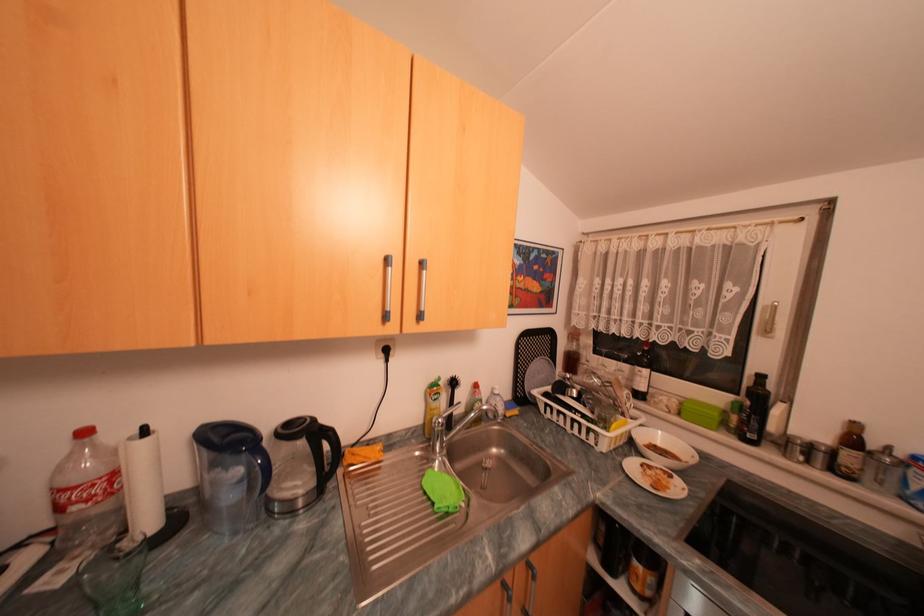
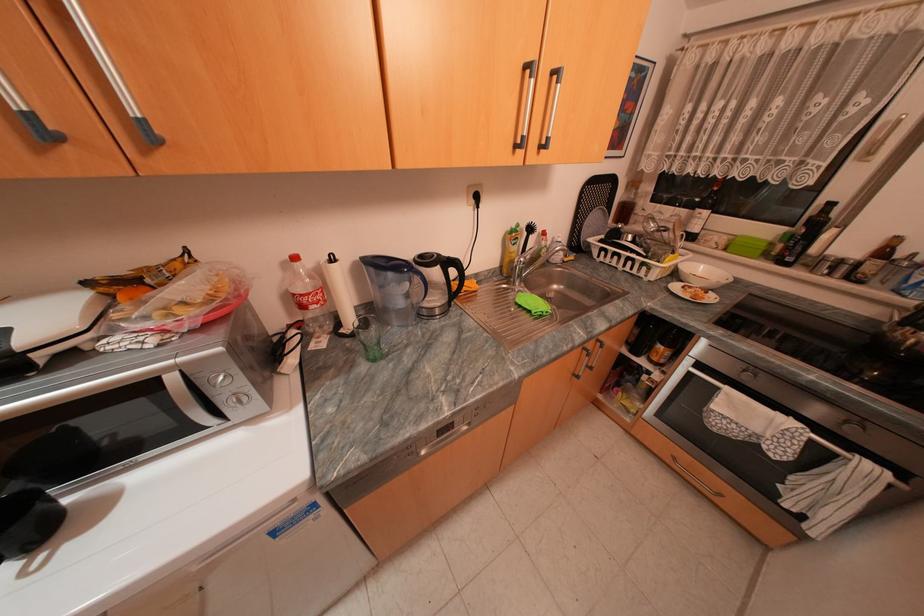
Locate, in the second image, the point that corresponds to the point at 334,445 in the first image.

(463, 270)